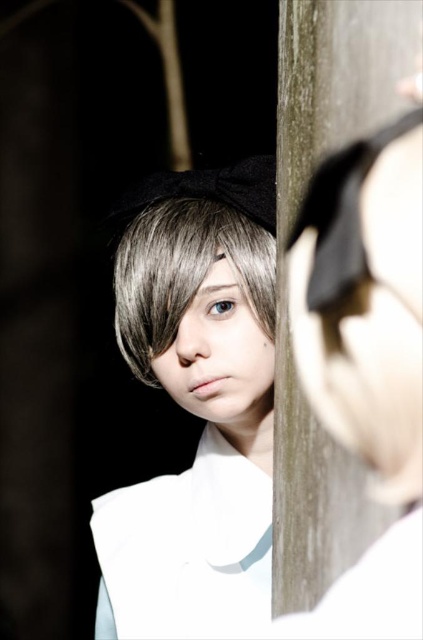
Based on the description, can you determine which object is taller between the smooth brown hair at center and the matte gray eye at center?

The smooth brown hair at center is much taller than the matte gray eye at center.

You are a photographer adjusting your camera settings. You want to focus on the point at coordinates point (261, 547). Given that the point and camera are 32.06 inches apart, is this distance within the typical depth of field range for a portrait shot?

The point (261, 547) is 32.06 inches away from the camera. This distance is within the typical depth of field range for a portrait shot, ensuring the subject remains in focus.